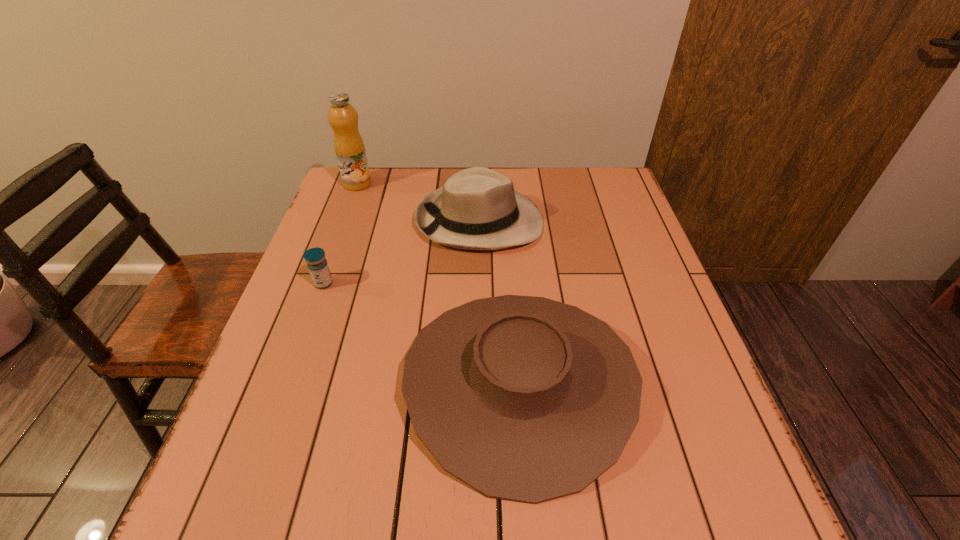
At what (x,y) coordinates should I click in order to perform the action: click on vacant area at the left edge. Please return your answer as a coordinate pair (x, y). Looking at the image, I should click on (341, 235).

The image size is (960, 540). In order to click on vacant space at the right edge in this screenshot , I will do (612, 239).

In the image, there is a desktop. Identify the location of vacant space at the far right corner. (597, 185).

The image size is (960, 540). Find the location of `vacant space at the near right corner of the desktop`. vacant space at the near right corner of the desktop is located at coordinates (747, 489).

Find the location of `vacant space that's between the fruit juice and the fedora`. vacant space that's between the fruit juice and the fedora is located at coordinates (419, 202).

In order to click on free point between the medicine and the tallest object in this screenshot , I will do `click(341, 234)`.

Where is `free space that is in between the fruit juice and the second nearest object`? Image resolution: width=960 pixels, height=540 pixels. free space that is in between the fruit juice and the second nearest object is located at coordinates point(341,234).

The height and width of the screenshot is (540, 960). I want to click on free space between the third farthest object and the fedora, so click(x=402, y=252).

Locate an element on the screen. empty space between the shortest object and the fedora is located at coordinates (402, 252).

This screenshot has height=540, width=960. Identify the location of vacant point located between the fruit juice and the fedora. (419, 202).